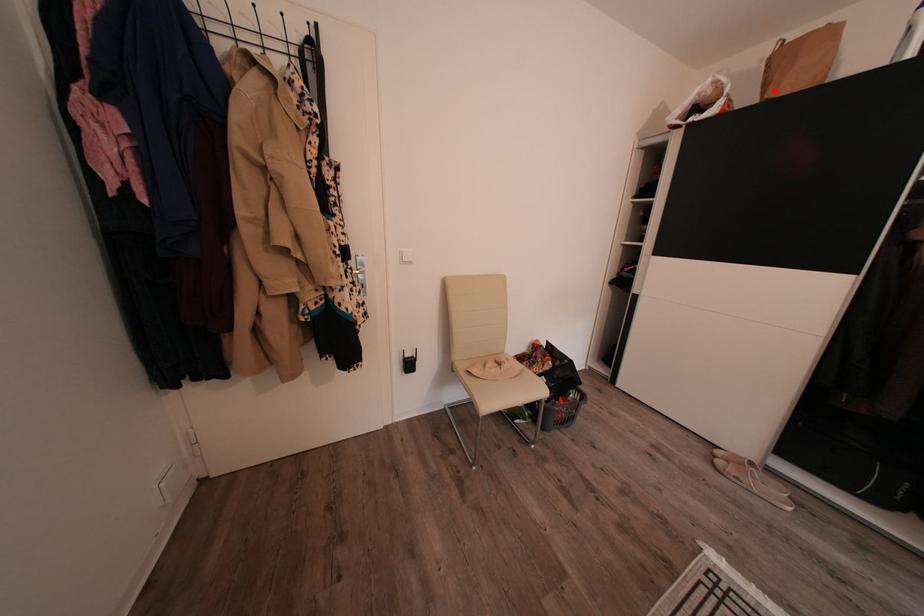
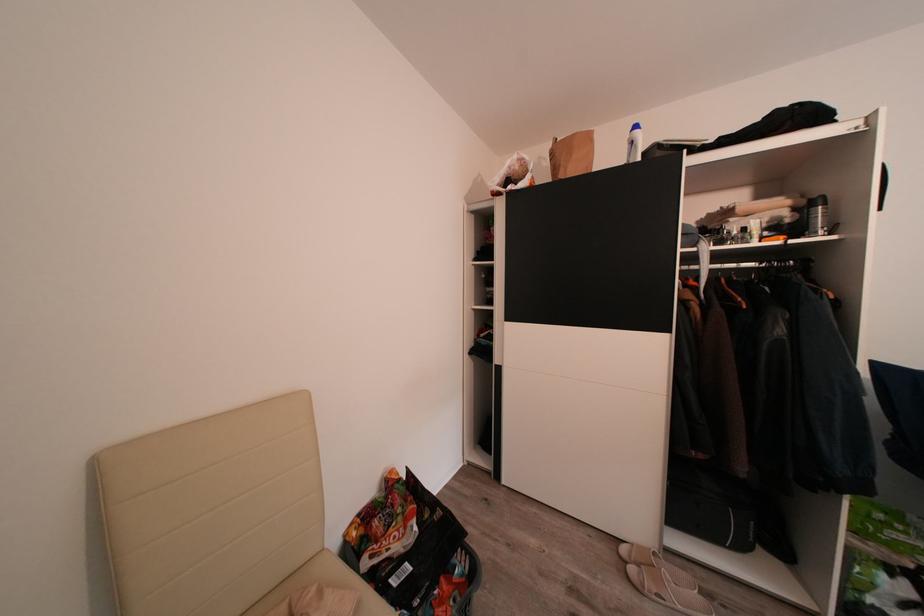
The point at the highlighted location is marked in the first image. Where is the corresponding point in the second image?

(564, 174)